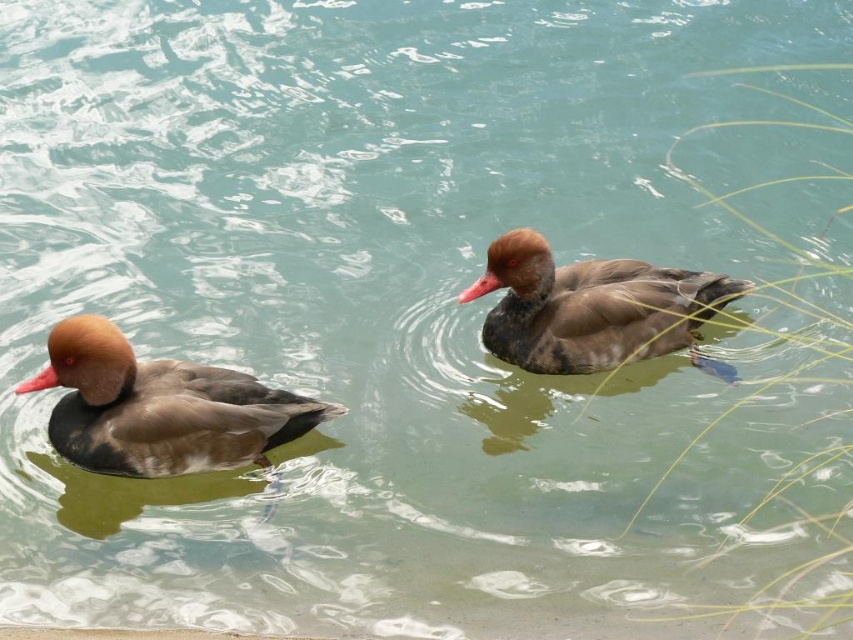
Is point (100, 458) positioned behind point (722, 364)?

No.

Between point (119, 339) and point (561, 333), which one is positioned in front?

Point (119, 339) is in front.

Where is `brown matte duck at left`? brown matte duck at left is located at coordinates (160, 406).

Image resolution: width=853 pixels, height=640 pixels. In order to click on brown matte duck at left in this screenshot , I will do `click(160, 406)`.